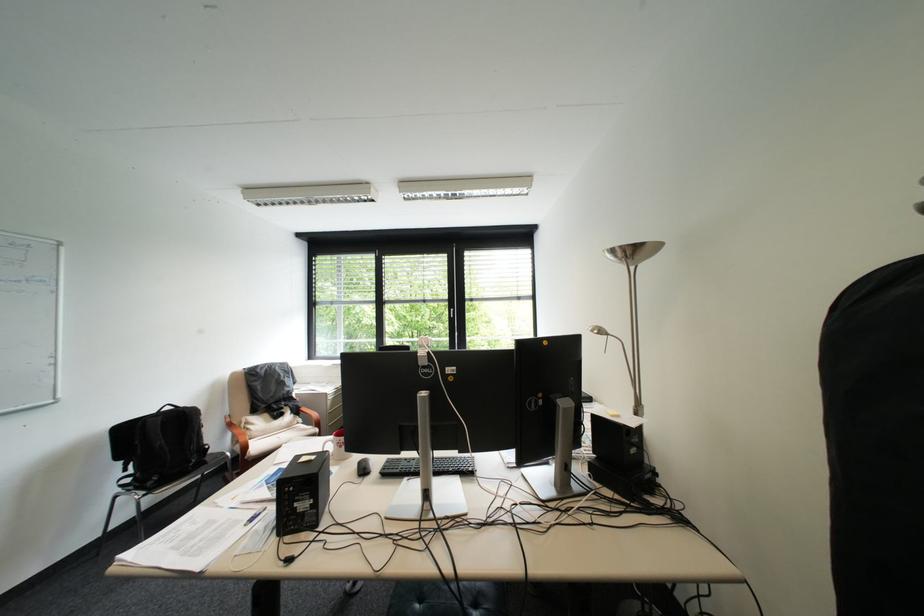
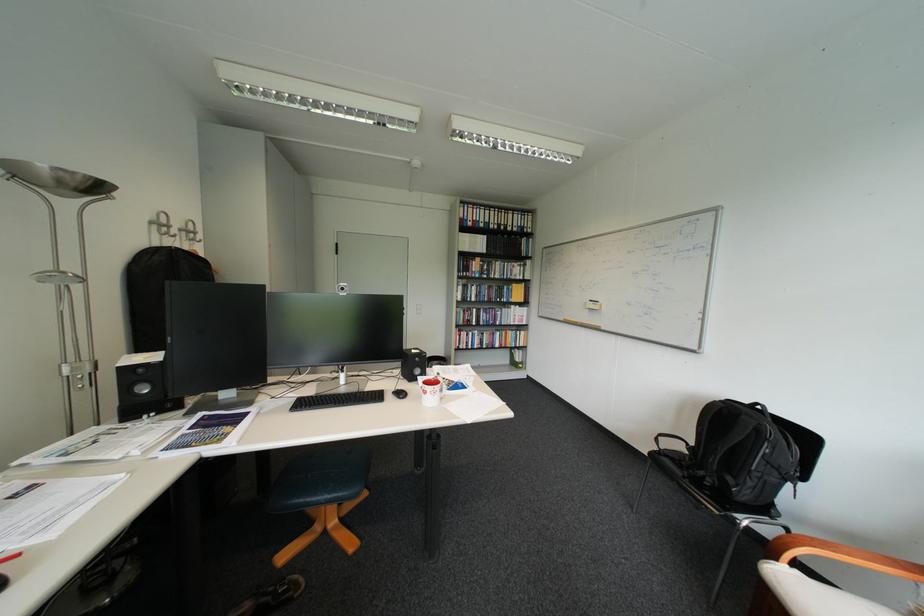
Locate, in the second image, the point that corresponds to point (198, 411) in the first image.

(756, 418)